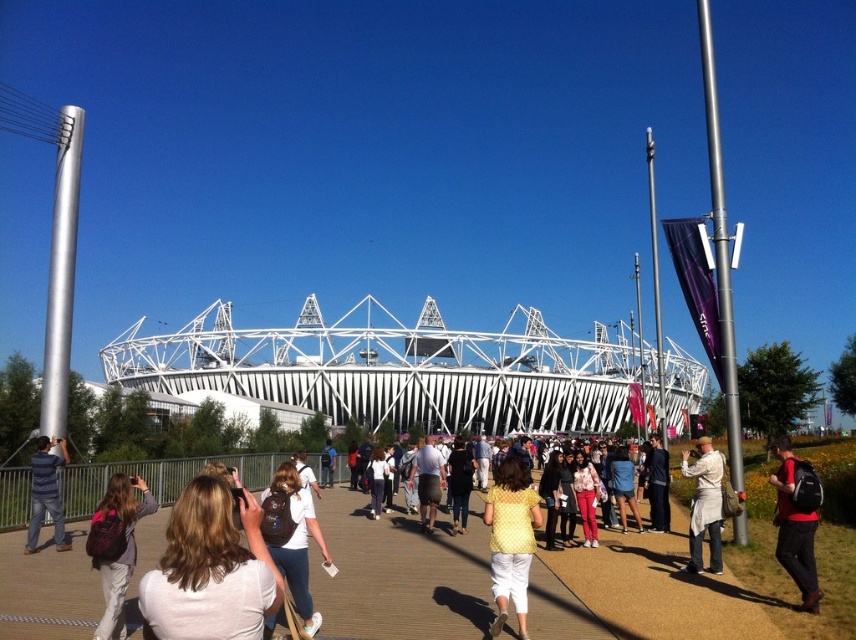
Question: Which object is the closest to the matte black jacket at center?

Choices:
 (A) light beige trench coat at lower right
 (B) white cotton shirt at center
 (C) white matte shirt at center
 (D) light brown backpack at center

Answer: (A)

Question: Is brown fabric backpack at center wider than light beige trench coat at lower right?

Choices:
 (A) yes
 (B) no

Answer: (B)

Question: Is khaki shorts at center bigger than white cotton shirt at center?

Choices:
 (A) no
 (B) yes

Answer: (A)

Question: Which point is farther to the camera?

Choices:
 (A) matte black jacket at center
 (B) brown textured boardwalk at center
 (C) striped cotton shirt at center

Answer: (A)

Question: Can you confirm if light beige trench coat at lower right is smaller than matte black jacket at center?

Choices:
 (A) no
 (B) yes

Answer: (A)

Question: Among these points, which one is nearest to the camera?

Choices:
 (A) (705, 436)
 (B) (293, 456)
 (C) (36, 468)

Answer: (C)